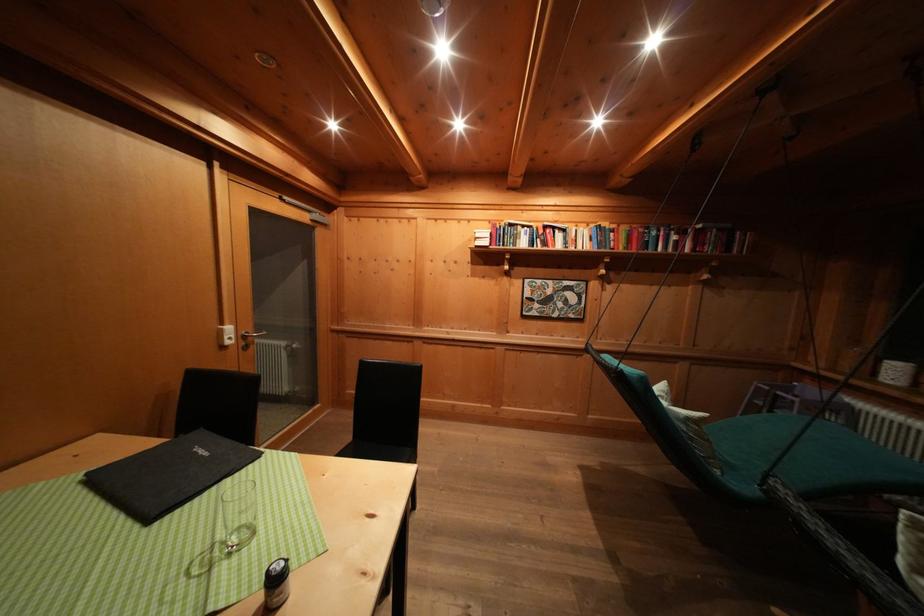
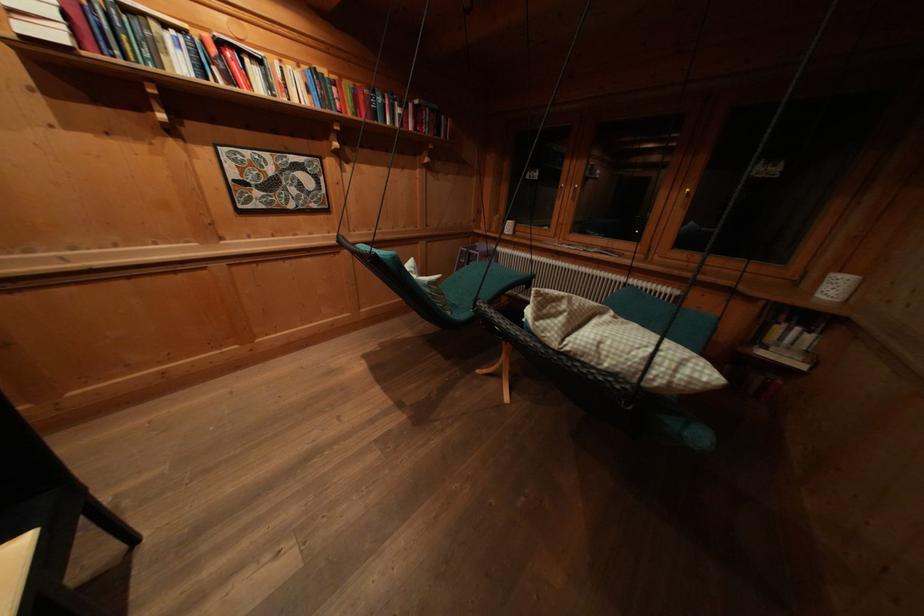
Where in the second image is the point corresponding to [709,424] from the first image?

(444, 285)